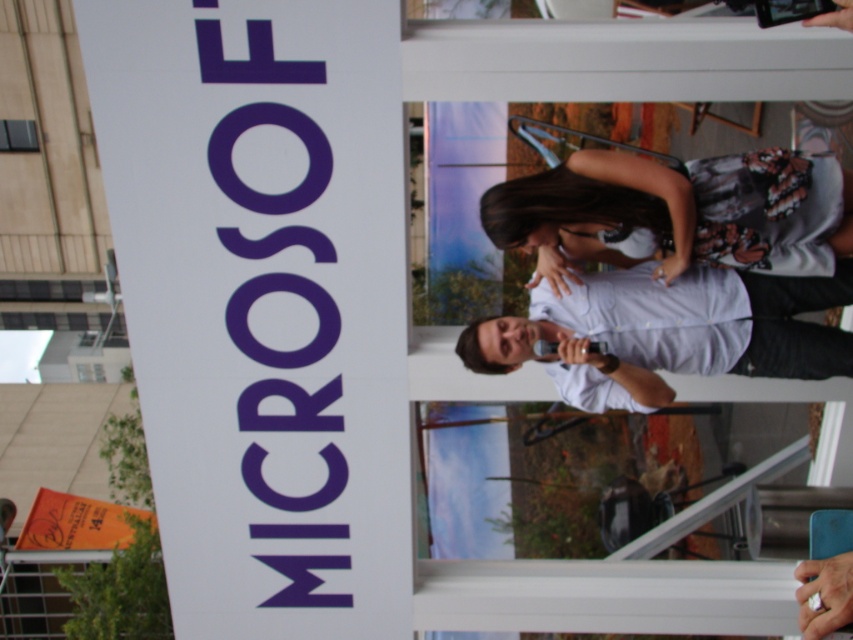
You are standing in front of the Microsoft promotional setup. Where exactly is the white paper sign at upper left located?

Answer: The white paper sign at upper left is located at point (263, 301).

You are standing in front of the Microsoft promotional setup. You see a white paper sign at upper left and a white matte shirt at center. Which object is positioned to the left of the other?

The white paper sign at upper left is positioned to the left of the white matte shirt at center.